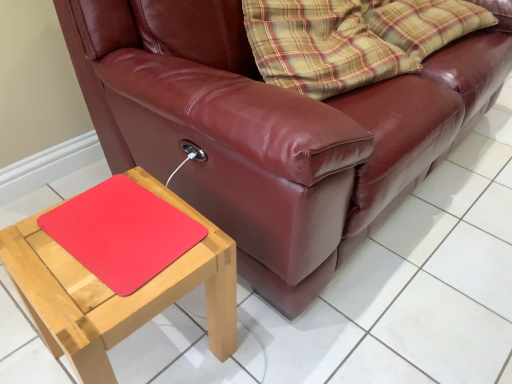
Question: From the image's perspective, is rubberized red mouse pad at lower left located beneath natural wood table at lower left?

Choices:
 (A) no
 (B) yes

Answer: (A)

Question: Is rubberized red mouse pad at lower left turned away from natural wood table at lower left?

Choices:
 (A) yes
 (B) no

Answer: (A)

Question: From a real-world perspective, is rubberized red mouse pad at lower left located beneath natural wood table at lower left?

Choices:
 (A) no
 (B) yes

Answer: (A)

Question: Is rubberized red mouse pad at lower left surrounding natural wood table at lower left?

Choices:
 (A) yes
 (B) no

Answer: (B)

Question: From a real-world perspective, is rubberized red mouse pad at lower left positioned over natural wood table at lower left based on gravity?

Choices:
 (A) yes
 (B) no

Answer: (A)

Question: Considering the positions of rubberized red mouse pad at lower left and natural wood table at lower left in the image, is rubberized red mouse pad at lower left bigger or smaller than natural wood table at lower left?

Choices:
 (A) small
 (B) big

Answer: (A)

Question: Considering their positions, is rubberized red mouse pad at lower left located in front of or behind natural wood table at lower left?

Choices:
 (A) front
 (B) behind

Answer: (B)

Question: From the image's perspective, relative to natural wood table at lower left, is rubberized red mouse pad at lower left above or below?

Choices:
 (A) below
 (B) above

Answer: (B)

Question: From a real-world perspective, relative to natural wood table at lower left, is rubberized red mouse pad at lower left vertically above or below?

Choices:
 (A) below
 (B) above

Answer: (B)

Question: Is natural wood table at lower left situated inside rubberized red mouse pad at lower left or outside?

Choices:
 (A) inside
 (B) outside

Answer: (B)

Question: Relative to rubberized red mouse pad at lower left, is natural wood table at lower left in front or behind?

Choices:
 (A) front
 (B) behind

Answer: (A)

Question: Is point (10, 256) closer or farther from the camera than point (124, 213)?

Choices:
 (A) farther
 (B) closer

Answer: (B)

Question: From the image's perspective, relative to rubberized red mouse pad at lower left, is natural wood table at lower left above or below?

Choices:
 (A) above
 (B) below

Answer: (B)

Question: From a real-world perspective, relative to rubberized red mouse pad at lower left, is leather couch at center vertically above or below?

Choices:
 (A) above
 (B) below

Answer: (A)

Question: In terms of size, does leather couch at center appear bigger or smaller than rubberized red mouse pad at lower left?

Choices:
 (A) small
 (B) big

Answer: (B)